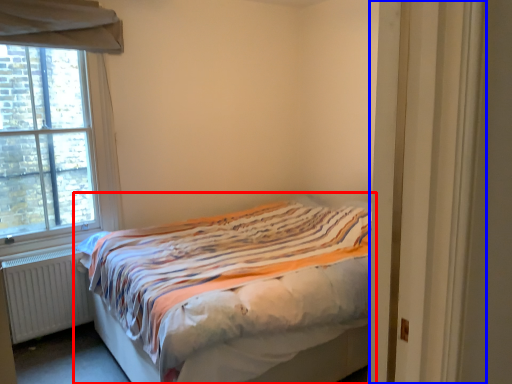
Question: Which object is further to the camera taking this photo, bed (highlighted by a red box) or door (highlighted by a blue box)?

Choices:
 (A) bed
 (B) door

Answer: (A)